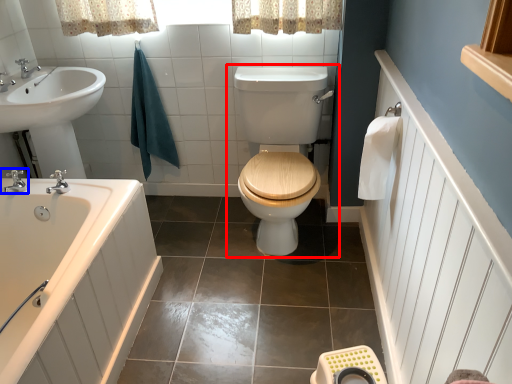
Question: Which object appears closest to the camera in this image, toilet (highlighted by a red box) or tap (highlighted by a blue box)?

Choices:
 (A) toilet
 (B) tap

Answer: (A)